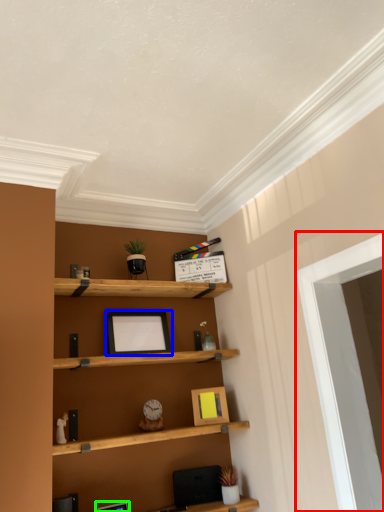
Question: Considering the real-world distances, which object is closest to window (highlighted by a red box)? picture frame (highlighted by a blue box) or picture frame (highlighted by a green box).

Choices:
 (A) picture frame
 (B) picture frame

Answer: (A)